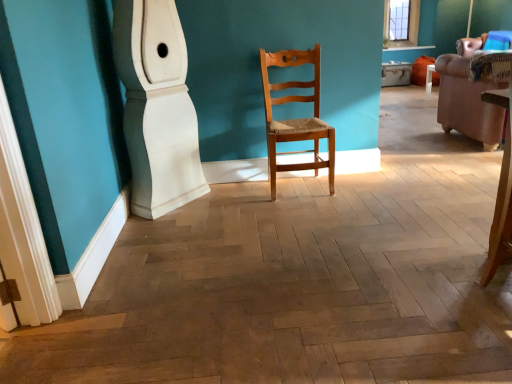
Question: Considering the relative sizes of brown leather armchair at right and white glossy baseboard at lower left in the image provided, is brown leather armchair at right smaller than white glossy baseboard at lower left?

Choices:
 (A) no
 (B) yes

Answer: (A)

Question: Does brown leather armchair at right appear on the right side of white glossy baseboard at lower left?

Choices:
 (A) yes
 (B) no

Answer: (A)

Question: From a real-world perspective, does brown leather armchair at right sit lower than white glossy baseboard at lower left?

Choices:
 (A) no
 (B) yes

Answer: (B)

Question: Is brown leather armchair at right facing towards white glossy baseboard at lower left?

Choices:
 (A) no
 (B) yes

Answer: (A)

Question: From the image's perspective, is brown leather armchair at right located beneath white glossy baseboard at lower left?

Choices:
 (A) yes
 (B) no

Answer: (B)

Question: Can you confirm if brown leather armchair at right is shorter than white glossy baseboard at lower left?

Choices:
 (A) yes
 (B) no

Answer: (A)

Question: Considering the relative sizes of white glossy baseboard at lower left and brown leather armchair at right in the image provided, is white glossy baseboard at lower left wider than brown leather armchair at right?

Choices:
 (A) no
 (B) yes

Answer: (A)

Question: Is brown leather armchair at right at the back of white glossy baseboard at lower left?

Choices:
 (A) no
 (B) yes

Answer: (A)

Question: Is white glossy baseboard at lower left positioned behind brown leather armchair at right?

Choices:
 (A) yes
 (B) no

Answer: (B)

Question: Can you confirm if white glossy baseboard at lower left is shorter than brown leather armchair at right?

Choices:
 (A) yes
 (B) no

Answer: (B)

Question: Is brown leather armchair at right completely or partially inside white glossy baseboard at lower left?

Choices:
 (A) no
 (B) yes

Answer: (A)

Question: Are white glossy baseboard at lower left and brown leather armchair at right located far from each other?

Choices:
 (A) no
 (B) yes

Answer: (B)

Question: Is brown leather armchair at right to the left of natural wood chair at center from the viewer's perspective?

Choices:
 (A) no
 (B) yes

Answer: (A)